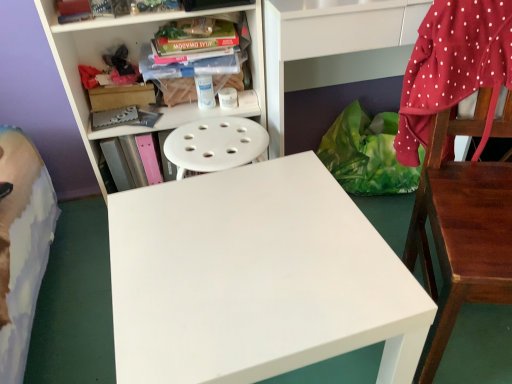
Where is `white plastic bookcase at upper left`? white plastic bookcase at upper left is located at coordinates (131, 59).

The width and height of the screenshot is (512, 384). What do you see at coordinates (461, 230) in the screenshot? I see `wooden chair at right` at bounding box center [461, 230].

Locate an element on the screen. This screenshot has height=384, width=512. hardcover book at upper center, acting as the first book starting from the top is located at coordinates (195, 59).

Describe the element at coordinates (256, 278) in the screenshot. I see `white matte table at center` at that location.

I want to click on green plastic bag at lower right, so click(366, 154).

Which object is positioned more to the left, white plastic bookcase at upper left or green plastic bag at lower right?

From the viewer's perspective, white plastic bookcase at upper left appears more on the left side.

The width and height of the screenshot is (512, 384). I want to click on material that is below the white plastic bookcase at upper left (from the image's perspective), so click(x=366, y=154).

Is white plastic bookcase at upper left thinner than green plastic bag at lower right?

Correct, the width of white plastic bookcase at upper left is less than that of green plastic bag at lower right.

Is point (113, 32) more distant than point (370, 183)?

No, (113, 32) is in front of (370, 183).

In the scene shown: How much distance is there between wooden chair at right and hardcover book at upper center, acting as the 2th book starting from the bottom?

They are 31.05 inches apart.

From a real-world perspective, who is located higher, wooden chair at right or hardcover book at upper center, acting as the 2th book starting from the bottom?

In real-world perspective, hardcover book at upper center, acting as the 2th book starting from the bottom, is above.

Visually, is wooden chair at right positioned to the left or to the right of hardcover book at upper center, acting as the 2th book starting from the bottom?

wooden chair at right is to the right of hardcover book at upper center, acting as the 2th book starting from the bottom.

Which is behind, point (436, 125) or point (190, 62)?

The point (190, 62) is behind.

Locate an element on the screen. chair that appears below the pink matte book at center-left, which is counted as the second book, starting from the top (from the image's perspective) is located at coordinates (461, 230).

From a real-world perspective, is wooden chair at right positioned under pink matte book at center-left, the 1th book from the bottom, based on gravity?

No, from a real-world perspective, wooden chair at right is not beneath pink matte book at center-left, the 1th book from the bottom.

Considering the sizes of objects wooden chair at right and pink matte book at center-left, the 1th book from the bottom, in the image provided, who is thinner, wooden chair at right or pink matte book at center-left, the 1th book from the bottom,?

pink matte book at center-left, the 1th book from the bottom.

Does point (472, 122) appear closer or farther from the camera than point (145, 135)?

Point (472, 122) is closer to the camera than point (145, 135).

Can you confirm if pink matte book at center-left, the 1th book from the bottom, is thinner than red polka dot fabric at right?

In fact, pink matte book at center-left, the 1th book from the bottom, might be wider than red polka dot fabric at right.

Is the depth of pink matte book at center-left, which is counted as the second book, starting from the top, less than that of red polka dot fabric at right?

No, it is behind red polka dot fabric at right.

Is pink matte book at center-left, the 1th book from the bottom, directly adjacent to red polka dot fabric at right?

No, pink matte book at center-left, the 1th book from the bottom, is not making contact with red polka dot fabric at right.

How different are the orientations of pink matte book at center-left, which is counted as the second book, starting from the top, and red polka dot fabric at right in degrees?

There is a 19.6-degree angle between the facing directions of pink matte book at center-left, which is counted as the second book, starting from the top, and red polka dot fabric at right.

Is pink matte book at center-left, the 1th book from the bottom, not near white plastic bookcase at upper left?

pink matte book at center-left, the 1th book from the bottom, is near white plastic bookcase at upper left, not far away.

Between pink matte book at center-left, which is counted as the second book, starting from the top, and white plastic bookcase at upper left, which one has smaller width?

pink matte book at center-left, which is counted as the second book, starting from the top.

Between pink matte book at center-left, the 1th book from the bottom, and white plastic bookcase at upper left, which one has more height?

white plastic bookcase at upper left is taller.

Is pink matte book at center-left, which is counted as the second book, starting from the top, oriented towards white plastic bookcase at upper left?

Yes, pink matte book at center-left, which is counted as the second book, starting from the top, is aimed at white plastic bookcase at upper left.

Considering the sizes of red polka dot fabric at right and wooden chair at right in the image, is red polka dot fabric at right bigger or smaller than wooden chair at right?

Considering their sizes, red polka dot fabric at right takes up less space than wooden chair at right.

Based on the photo, is the surface of red polka dot fabric at right in direct contact with wooden chair at right?

No, red polka dot fabric at right is not making contact with wooden chair at right.

Which of these two, red polka dot fabric at right or wooden chair at right, is wider?

Wider between the two is wooden chair at right.

Who is shorter, red polka dot fabric at right or wooden chair at right?

red polka dot fabric at right is shorter.

From their relative heights in the image, would you say green plastic bag at lower right is taller or shorter than white matte table at center?

green plastic bag at lower right is shorter than white matte table at center.

Is green plastic bag at lower right with white matte table at center?

No, green plastic bag at lower right is not in contact with white matte table at center.

From a real-world perspective, between green plastic bag at lower right and white matte table at center, who is vertically higher?

white matte table at center.

The height and width of the screenshot is (384, 512). What are the coordinates of `material below the white plastic bookcase at upper left (from a real-world perspective)` in the screenshot? It's located at (366, 154).

Find the location of a particular element. This screenshot has width=512, height=384. chair that is in front of the hardcover book at upper center, acting as the first book starting from the top is located at coordinates (461, 230).

When comparing their distances from green plastic bag at lower right, does pink matte book at center-left, which is counted as the second book, starting from the top, or wooden chair at right seem closer?

wooden chair at right is closer to green plastic bag at lower right.

Considering their positions, is hardcover book at upper center, acting as the first book starting from the top, positioned closer to white plastic bookcase at upper left than pink matte book at center-left, the 1th book from the bottom?

hardcover book at upper center, acting as the first book starting from the top, lies closer to white plastic bookcase at upper left than the other object.

Estimate the real-world distances between objects in this image. Which object is further from hardcover book at upper center, acting as the first book starting from the top, white matte table at center or wooden chair at right?

Among the two, wooden chair at right is located further to hardcover book at upper center, acting as the first book starting from the top.

Which object lies further to the anchor point green plastic bag at lower right, white matte table at center or hardcover book at upper center, acting as the 2th book starting from the bottom?

white matte table at center is further to green plastic bag at lower right.

Looking at the image, which one is located further to hardcover book at upper center, acting as the 2th book starting from the bottom, white plastic bookcase at upper left or pink matte book at center-left, which is counted as the second book, starting from the top?

pink matte book at center-left, which is counted as the second book, starting from the top.

Considering their positions, is white plastic bookcase at upper left positioned closer to red polka dot fabric at right than wooden chair at right?

The object closer to red polka dot fabric at right is wooden chair at right.

Which object lies further to the anchor point hardcover book at upper center, acting as the 2th book starting from the bottom, red polka dot fabric at right or white matte table at center?

white matte table at center.

Looking at this image, looking at the image, which one is located closer to pink matte book at center-left, the 1th book from the bottom, hardcover book at upper center, acting as the 2th book starting from the bottom, or red polka dot fabric at right?

The object closer to pink matte book at center-left, the 1th book from the bottom, is hardcover book at upper center, acting as the 2th book starting from the bottom.

Where is `blanket between white matte table at center and green plastic bag at lower right along the z-axis`? This screenshot has height=384, width=512. blanket between white matte table at center and green plastic bag at lower right along the z-axis is located at coordinates (453, 67).

Image resolution: width=512 pixels, height=384 pixels. What are the coordinates of `table between wooden chair at right and green plastic bag at lower right along the z-axis` in the screenshot? It's located at (256, 278).

I want to click on table between pink matte book at center-left, which is counted as the second book, starting from the top, and red polka dot fabric at right, in the horizontal direction, so click(256, 278).

The width and height of the screenshot is (512, 384). Find the location of `table between hardcover book at upper center, acting as the 2th book starting from the bottom, and red polka dot fabric at right, in the horizontal direction`. table between hardcover book at upper center, acting as the 2th book starting from the bottom, and red polka dot fabric at right, in the horizontal direction is located at coordinates (256, 278).